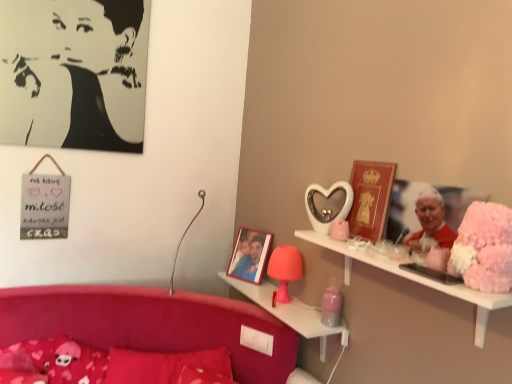
I want to click on free space above white matte shelf at upper right, which ranks as the second shelf in bottom-to-top order (from a real-world perspective), so click(390, 254).